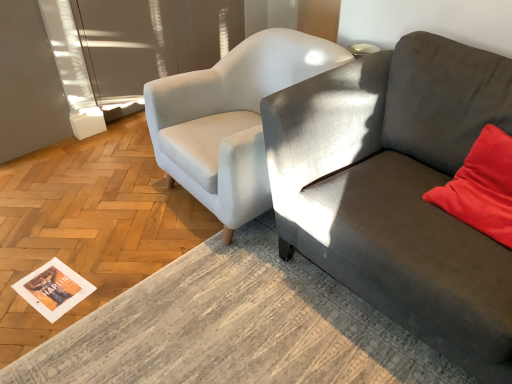
The height and width of the screenshot is (384, 512). In order to click on free space in front of white paper magazine at lower left in this screenshot , I will do `click(37, 331)`.